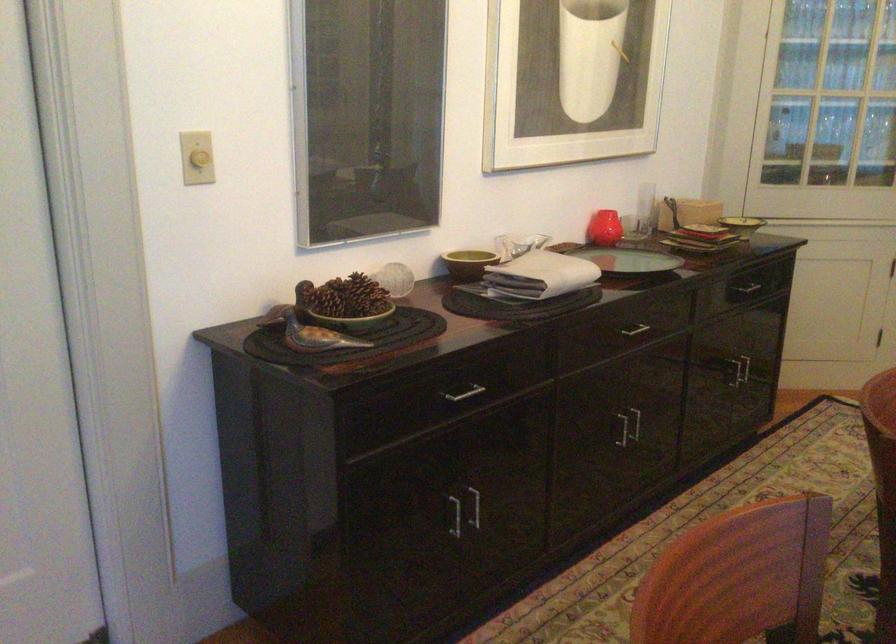
Locate an element on the screen. small yellow bowl is located at coordinates (468, 263).